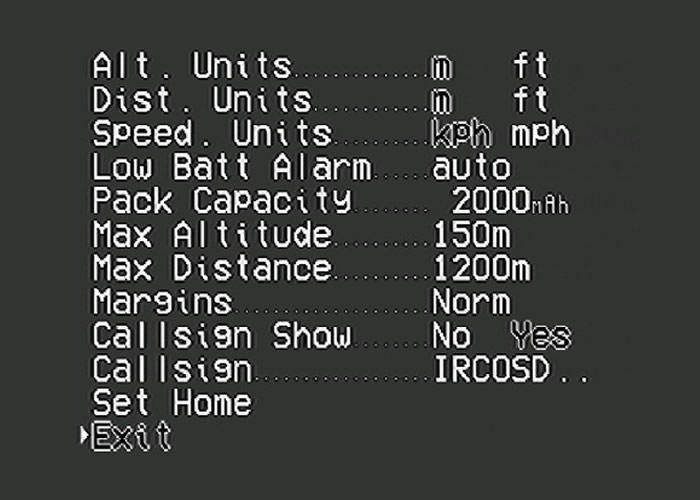
You are a GUI agent. You are given a task and a screenshot of the screen. Output one action in this format:
    pyautogui.click(x=<x>, y=<y>)
    Task: Click on the exit button
    Image resolution: width=700 pixels, height=500 pixels.
    Given the screenshot: What is the action you would take?
    pyautogui.click(x=94, y=434), pyautogui.click(x=122, y=440), pyautogui.click(x=141, y=440), pyautogui.click(x=162, y=436)